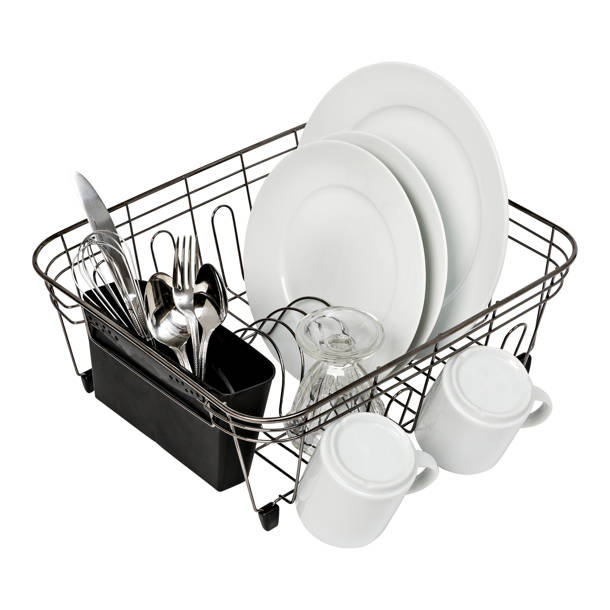
The width and height of the screenshot is (610, 610). Find the location of `mugs`. mugs is located at coordinates (375, 461), (479, 418).